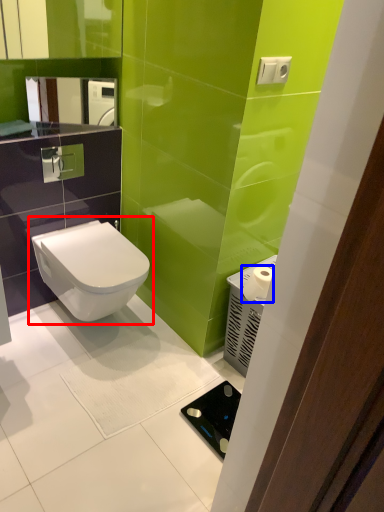
Question: Which object is further to the camera taking this photo, toilet (highlighted by a red box) or toilet paper (highlighted by a blue box)?

Choices:
 (A) toilet
 (B) toilet paper

Answer: (A)